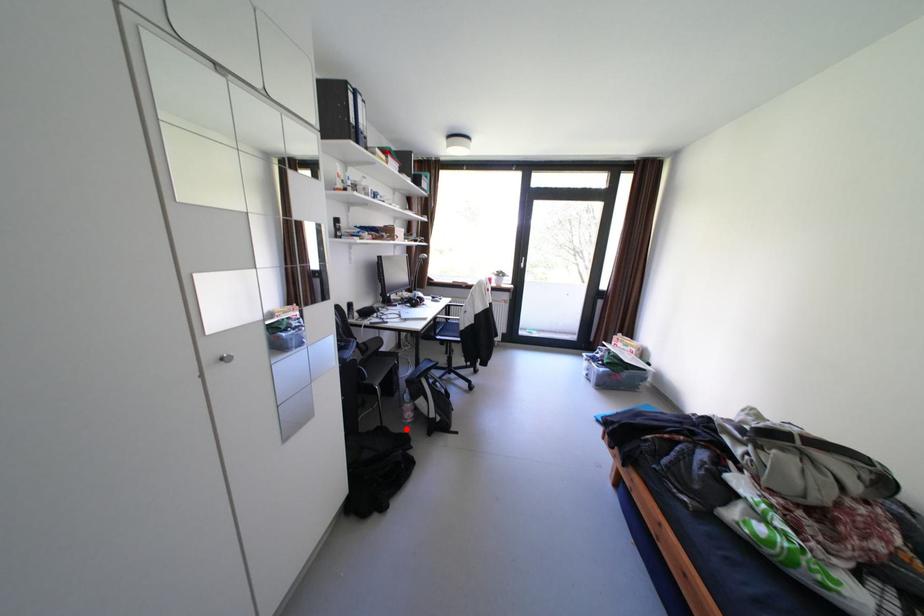
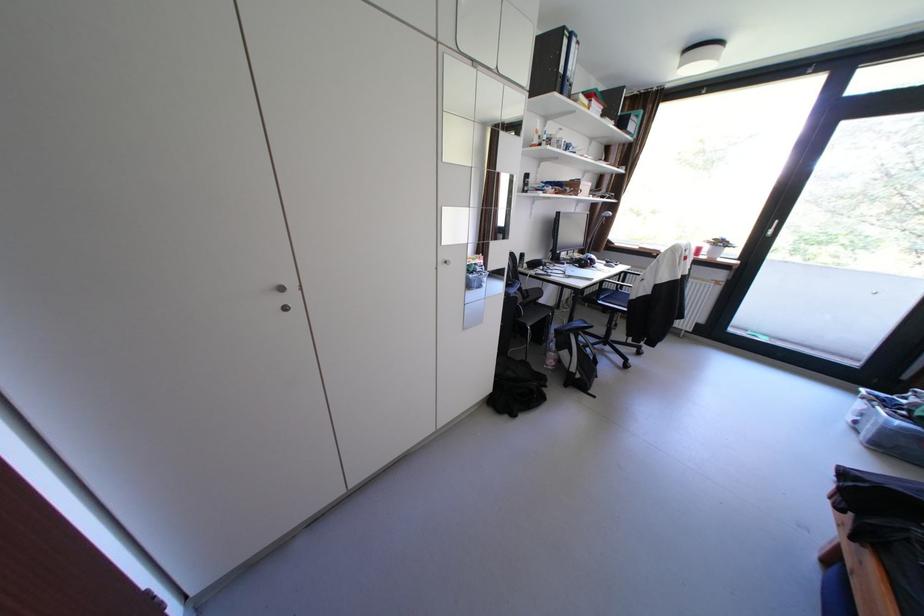
Question: I am providing you with two images of the same scene from different viewpoints. A red point is marked on the first image. Can you still see the location of the red point in image 2?

Choices:
 (A) Yes
 (B) No

Answer: (A)